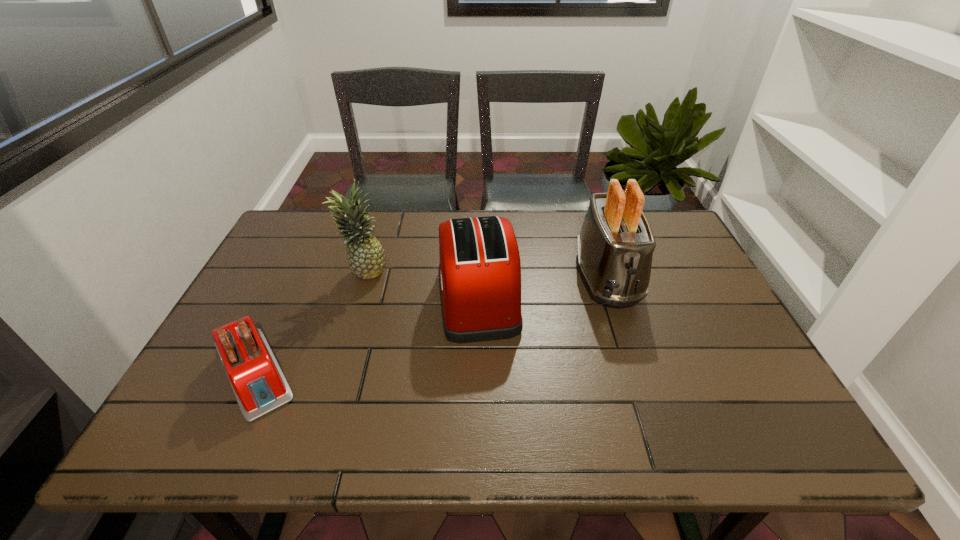
The image size is (960, 540). I want to click on the rightmost object, so click(616, 243).

Find the location of a particular element. This screenshot has height=540, width=960. the tallest toaster is located at coordinates (616, 243).

Locate an element on the screen. This screenshot has width=960, height=540. the third object from right to left is located at coordinates (365, 255).

At what (x,y) coordinates should I click in order to perform the action: click on the second tallest toaster. Please return your answer as a coordinate pair (x, y). The width and height of the screenshot is (960, 540). Looking at the image, I should click on (479, 272).

Locate an element on the screen. Image resolution: width=960 pixels, height=540 pixels. the second shortest object is located at coordinates (479, 272).

At what (x,y) coordinates should I click in order to perform the action: click on the shortest toaster. Please return your answer as a coordinate pair (x, y). Looking at the image, I should click on (259, 385).

Locate an element on the screen. This screenshot has height=540, width=960. the leftmost toaster is located at coordinates [x=259, y=385].

Where is `vacant area located 0.310m on the side of the rightmost object with the control lever`? The height and width of the screenshot is (540, 960). vacant area located 0.310m on the side of the rightmost object with the control lever is located at coordinates (657, 425).

Image resolution: width=960 pixels, height=540 pixels. I want to click on vacant space located 0.180m on the front of the pineapple, so click(x=345, y=336).

The image size is (960, 540). What are the coordinates of `free space located on the back of the second object from right to left` in the screenshot? It's located at (478, 251).